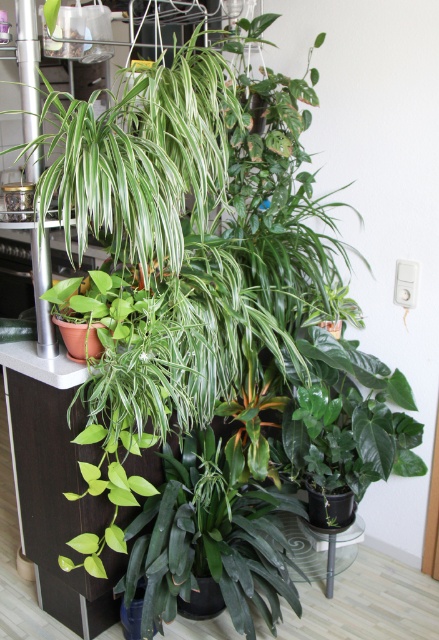
Question: In this image, where is green matte leafy plant at center-right located relative to green matte pothos at left?

Choices:
 (A) above
 (B) below

Answer: (B)

Question: Does green matte leafy plant at center-right have a greater width compared to green matte pothos at left?

Choices:
 (A) no
 (B) yes

Answer: (B)

Question: Which object appears farthest from the camera in this image?

Choices:
 (A) green matte leafy plant at center-right
 (B) green matte pothos at left

Answer: (A)

Question: Can you confirm if green matte leafy plant at center-right is bigger than green matte pothos at left?

Choices:
 (A) no
 (B) yes

Answer: (B)

Question: Which object is closer to the camera taking this photo?

Choices:
 (A) green matte pothos at left
 (B) green matte leafy plant at center-right

Answer: (A)

Question: Which point is farther from the camera taking this photo?

Choices:
 (A) (357, 400)
 (B) (114, 332)

Answer: (A)